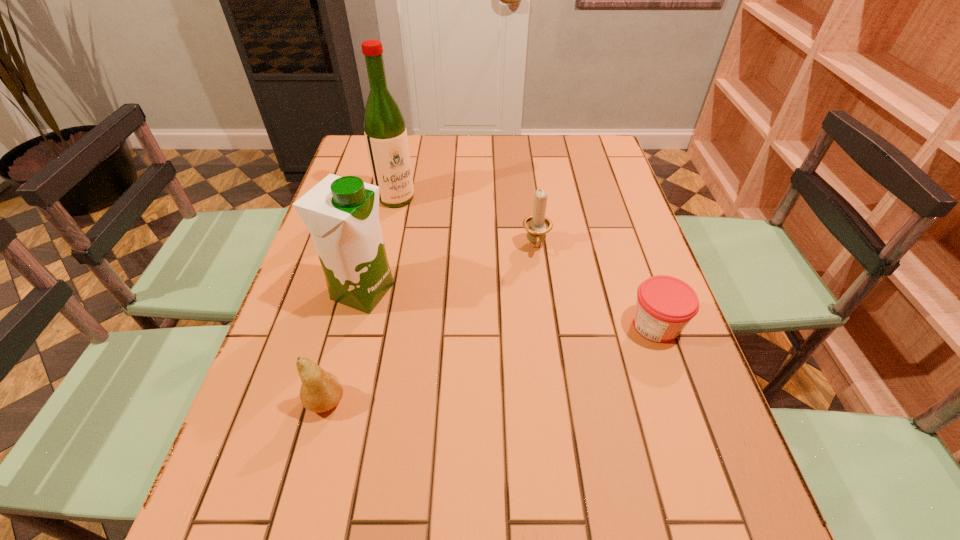
The image size is (960, 540). In order to click on free space located on the label of the tallest object in this screenshot , I will do `click(429, 238)`.

Find the location of a particular element. The width and height of the screenshot is (960, 540). blank space located 0.250m on the label of the tallest object is located at coordinates (444, 257).

This screenshot has width=960, height=540. In order to click on vacant space located 0.290m on the label of the tallest object in this screenshot , I will do `click(452, 266)`.

This screenshot has height=540, width=960. Find the location of `free space located on the handle side of the fourth object from left to right`. free space located on the handle side of the fourth object from left to right is located at coordinates (540, 319).

What are the coordinates of `vacant area located 0.310m on the handle side of the fourth object from left to right` in the screenshot? It's located at (541, 360).

Image resolution: width=960 pixels, height=540 pixels. In order to click on blank area located 0.280m on the handle side of the fourth object from left to right in this screenshot , I will do `click(540, 348)`.

This screenshot has width=960, height=540. I want to click on vacant space located on the front-facing side of the fourth shortest object, so click(535, 353).

The width and height of the screenshot is (960, 540). What are the coordinates of `vacant space situated on the front-facing side of the fourth shortest object` in the screenshot? It's located at (509, 343).

I want to click on vacant region located 0.240m on the front-facing side of the fourth shortest object, so click(x=484, y=335).

Locate an element on the screen. This screenshot has width=960, height=540. pear that is at the left edge is located at coordinates (320, 391).